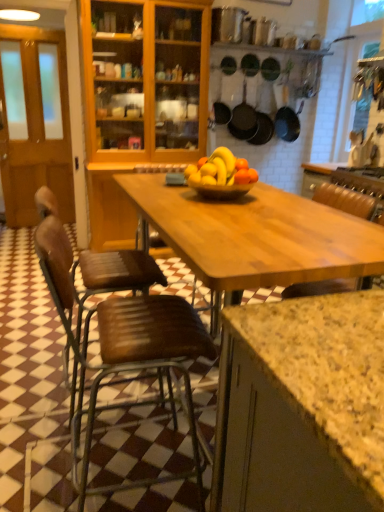
Question: Which direction should I rotate to look at black matte frying pan at upper center, arranged as the fourth frying pan when viewed from the left?

Choices:
 (A) left
 (B) right

Answer: (B)

Question: Is black matte frying pan at upper center, marked as the first frying pan in a right-to-left arrangement, located within matte black frying pan at center, the third frying pan from the right?

Choices:
 (A) no
 (B) yes

Answer: (A)

Question: Does matte black frying pan at center, the second frying pan viewed from the left, have a greater height compared to black matte frying pan at upper center, marked as the first frying pan in a right-to-left arrangement?

Choices:
 (A) no
 (B) yes

Answer: (A)

Question: Is matte black frying pan at center, the third frying pan from the right, positioned beyond the bounds of black matte frying pan at upper center, arranged as the fourth frying pan when viewed from the left?

Choices:
 (A) yes
 (B) no

Answer: (A)

Question: Does matte black frying pan at center, the third frying pan from the right, have a larger size compared to black matte frying pan at upper center, marked as the first frying pan in a right-to-left arrangement?

Choices:
 (A) yes
 (B) no

Answer: (B)

Question: Is matte black frying pan at center, the third frying pan from the right, wider than black matte frying pan at upper center, marked as the first frying pan in a right-to-left arrangement?

Choices:
 (A) yes
 (B) no

Answer: (B)

Question: Is the surface of matte black frying pan at center, the third frying pan from the right, in direct contact with black matte frying pan at upper center, marked as the first frying pan in a right-to-left arrangement?

Choices:
 (A) no
 (B) yes

Answer: (A)

Question: From a real-world perspective, is brown wooden door at left over brown wooden chair at lower left, which appears as the 2th chair when viewed from the back?

Choices:
 (A) no
 (B) yes

Answer: (B)

Question: Is brown wooden door at left not close to brown wooden chair at lower left, which appears as the 2th chair when viewed from the back?

Choices:
 (A) yes
 (B) no

Answer: (A)

Question: Is brown wooden door at left to the right of brown wooden chair at lower left, which appears as the 2th chair when viewed from the back, from the viewer's perspective?

Choices:
 (A) no
 (B) yes

Answer: (A)

Question: Is brown wooden door at left turned away from brown wooden chair at lower left, which appears as the 2th chair when viewed from the back?

Choices:
 (A) no
 (B) yes

Answer: (A)

Question: Does brown wooden door at left contain brown wooden chair at lower left, marked as the first chair in a front-to-back arrangement?

Choices:
 (A) yes
 (B) no

Answer: (B)

Question: Considering the relative sizes of brown wooden door at left and brown wooden chair at lower left, marked as the first chair in a front-to-back arrangement, in the image provided, is brown wooden door at left bigger than brown wooden chair at lower left, marked as the first chair in a front-to-back arrangement,?

Choices:
 (A) no
 (B) yes

Answer: (A)

Question: Is black matte frying pan at center, placed as the 1th frying pan when sorted from left to right, further to the viewer compared to matte black frying pan at upper center, which appears as the 3th frying pan when viewed from the left?

Choices:
 (A) yes
 (B) no

Answer: (B)